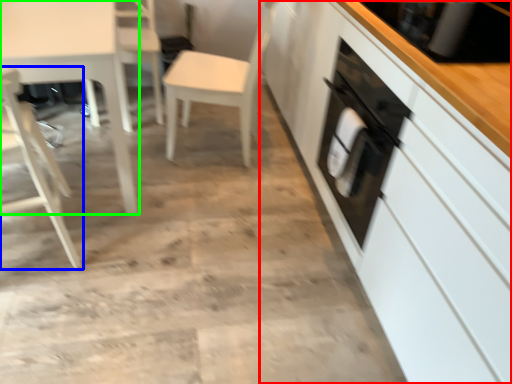
Question: Which object is the farthest from cabinetry (highlighted by a red box)? Choose among these: chair (highlighted by a blue box) or table (highlighted by a green box).

Choices:
 (A) chair
 (B) table

Answer: (A)